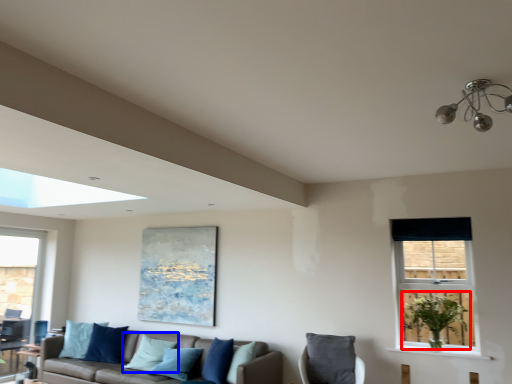
Question: Which object appears closest to the camera in this image, plant (highlighted by a red box) or pillow (highlighted by a blue box)?

Choices:
 (A) plant
 (B) pillow

Answer: (A)